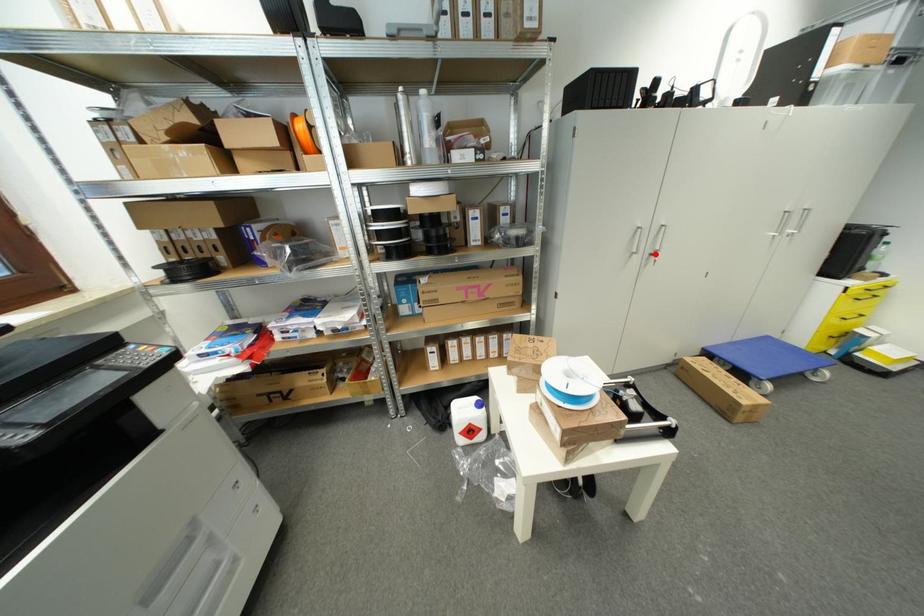
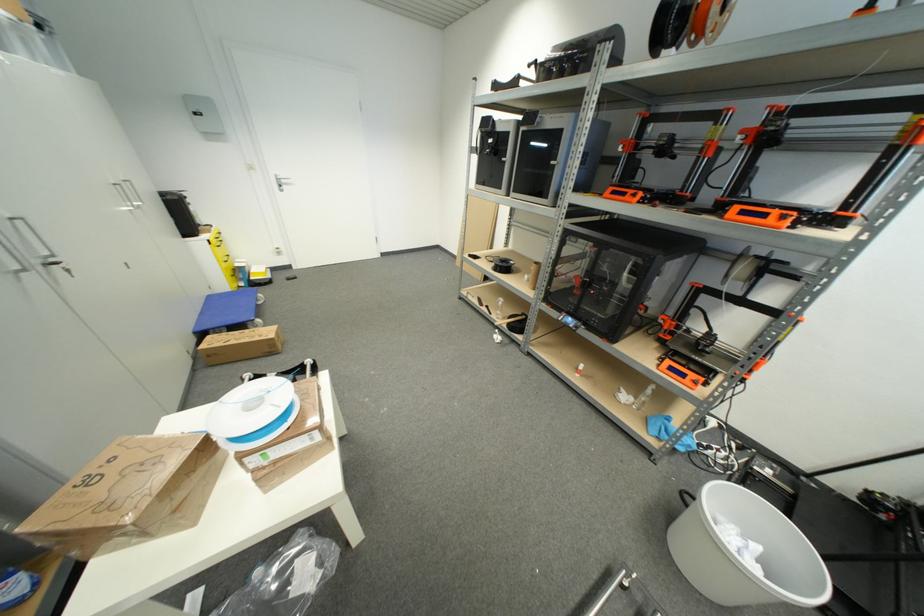
Question: A red point is marked in image1. In image2, is the corresponding 3D point closer to the camera or farther? Reply with the corresponding letter.

Choices:
 (A) The corresponding 3D point is closer.
 (B) The corresponding 3D point is farther.

Answer: (B)